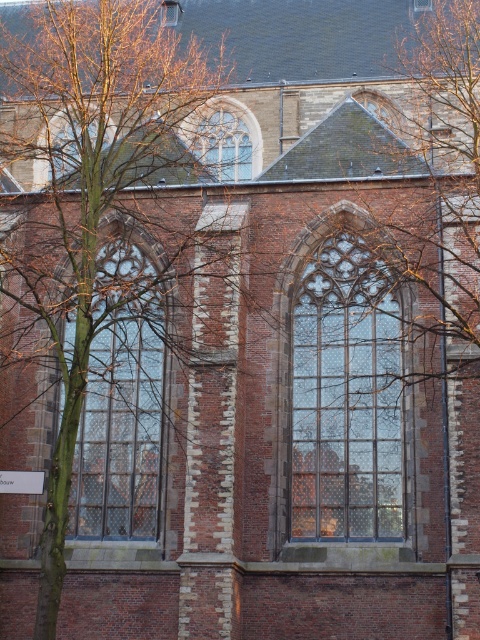
Between clear glass window at center and clear glass window at upper center, which one is positioned higher?

clear glass window at upper center is higher up.

Is clear glass window at center further to camera compared to clear glass window at upper center?

No, clear glass window at center is in front of clear glass window at upper center.

Between point (324, 332) and point (216, 154), which one is positioned in front?

Positioned in front is point (324, 332).

Find the location of a particular element. The image size is (480, 640). clear glass window at center is located at coordinates (346, 397).

Does clear glass window at left have a lesser height compared to clear glass window at upper center?

In fact, clear glass window at left may be taller than clear glass window at upper center.

Which is in front, point (133, 387) or point (236, 115)?

Point (133, 387)

Where is `clear glass window at left`? This screenshot has width=480, height=640. clear glass window at left is located at coordinates (120, 403).

From the picture: Does clear glass window at center have a greater height compared to clear glass window at left?

No.

Which of these two, clear glass window at center or clear glass window at left, stands taller?

Standing taller between the two is clear glass window at left.

Is point (339, 413) closer to camera compared to point (118, 312)?

Yes, it is.

The width and height of the screenshot is (480, 640). I want to click on clear glass window at center, so click(x=346, y=397).